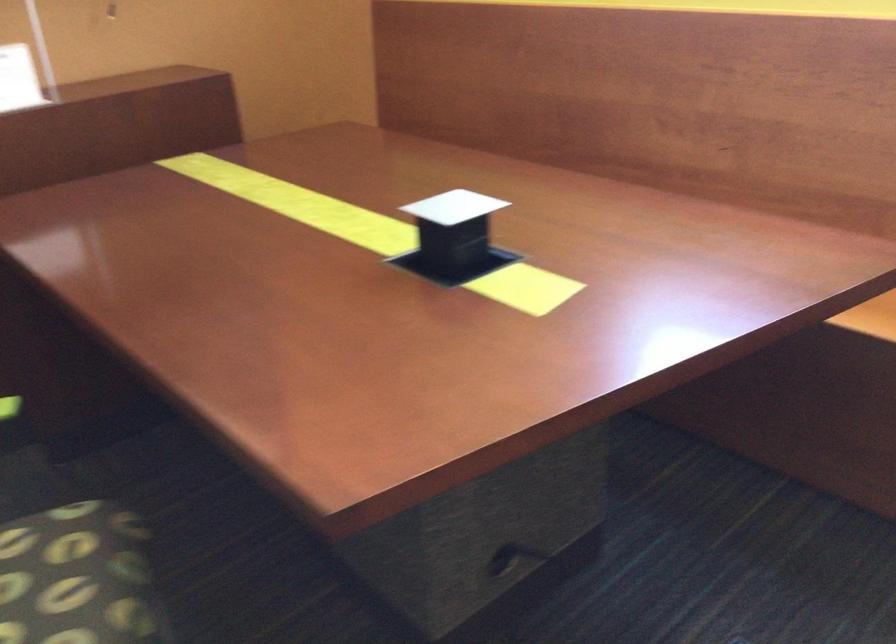
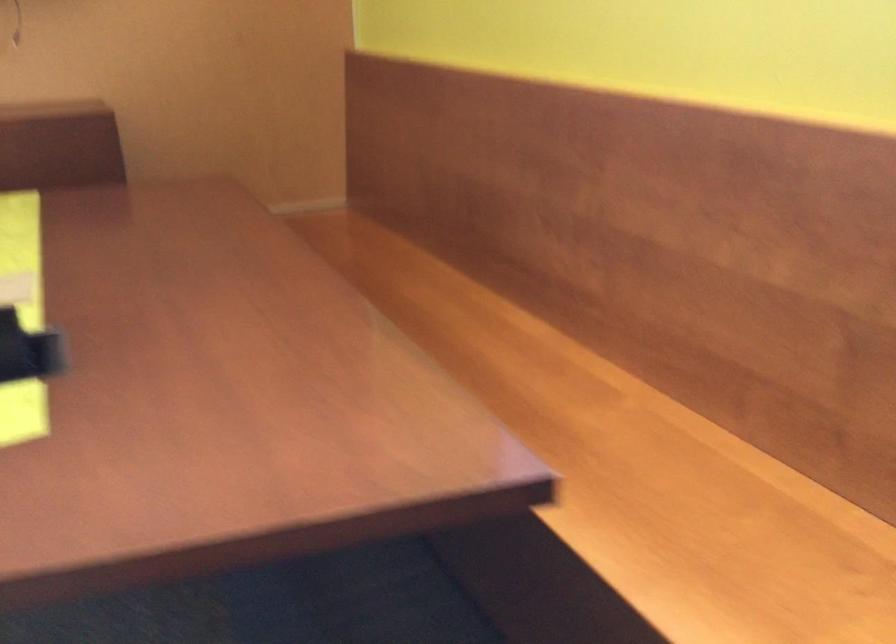
Which direction would the cameraman need to move to produce the second image?

The cameraman walked toward right, forward.